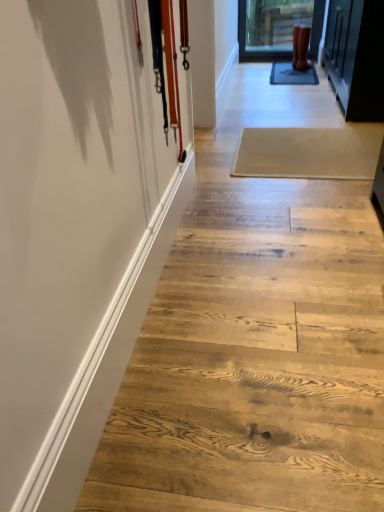
Question: Would you say natural wood stairs at center is inside or outside rubber matte boots at upper right?

Choices:
 (A) outside
 (B) inside

Answer: (A)

Question: From the image's perspective, is natural wood stairs at center located above or below rubber matte boots at upper right?

Choices:
 (A) above
 (B) below

Answer: (B)

Question: Which object is positioned closest to the beige wood plank at center?

Choices:
 (A) white glossy barn door at left
 (B) rubber matte boots at upper right
 (C) natural wood stairs at center

Answer: (C)

Question: Which is nearer to the rubber matte boots at upper right?

Choices:
 (A) beige wood plank at center
 (B) white glossy barn door at left
 (C) natural wood stairs at center

Answer: (A)